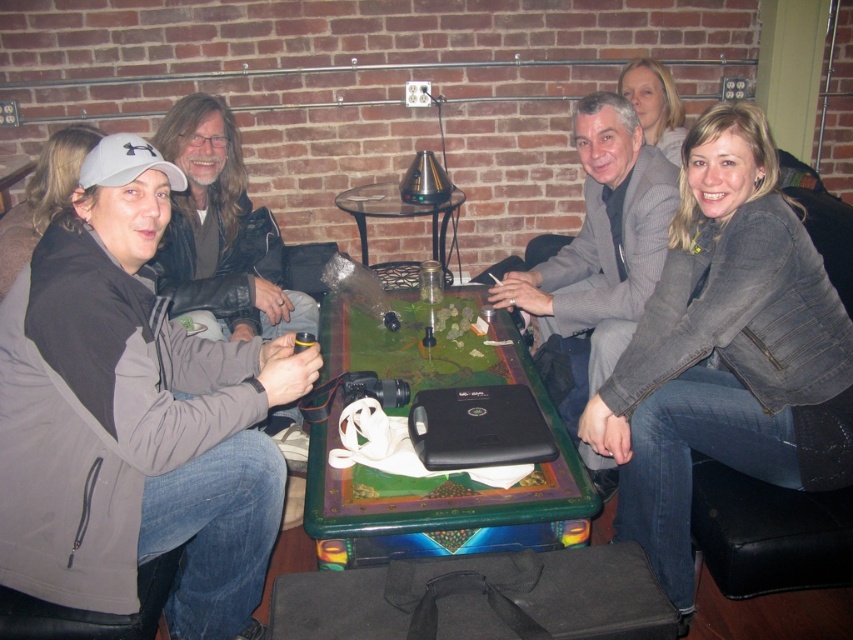
In the scene shown: Is green glossy table at center thinner than blonde hair at upper right?

In fact, green glossy table at center might be wider than blonde hair at upper right.

Who is more forward, (469,333) or (657,109)?

Point (469,333) is more forward.

Identify the location of green glossy table at center. pos(440,476).

Is gray matte jacket at left above gray textured suit at center?

Actually, gray matte jacket at left is below gray textured suit at center.

You are a GUI agent. You are given a task and a screenshot of the screen. Output one action in this format:
    pyautogui.click(x=<x>, y=<y>)
    Task: Click on the gray matte jacket at left
    The image size is (853, 640).
    Given the screenshot: What is the action you would take?
    pyautogui.click(x=132, y=417)

This screenshot has width=853, height=640. What do you see at coordinates (132, 417) in the screenshot?
I see `gray matte jacket at left` at bounding box center [132, 417].

You are a GUI agent. You are given a task and a screenshot of the screen. Output one action in this format:
    pyautogui.click(x=<x>, y=<y>)
    Task: Click on the gray matte jacket at left
    The height and width of the screenshot is (640, 853).
    Given the screenshot: What is the action you would take?
    pyautogui.click(x=132, y=417)

Does point (378, 198) lie in front of point (1, 182)?

No, (378, 198) is behind (1, 182).

Measure the distance between translucent glass table at center and camera.

translucent glass table at center and camera are 9.90 feet apart.

Does point (370, 216) come in front of point (19, 172)?

Yes.

I want to click on translucent glass table at center, so click(x=402, y=216).